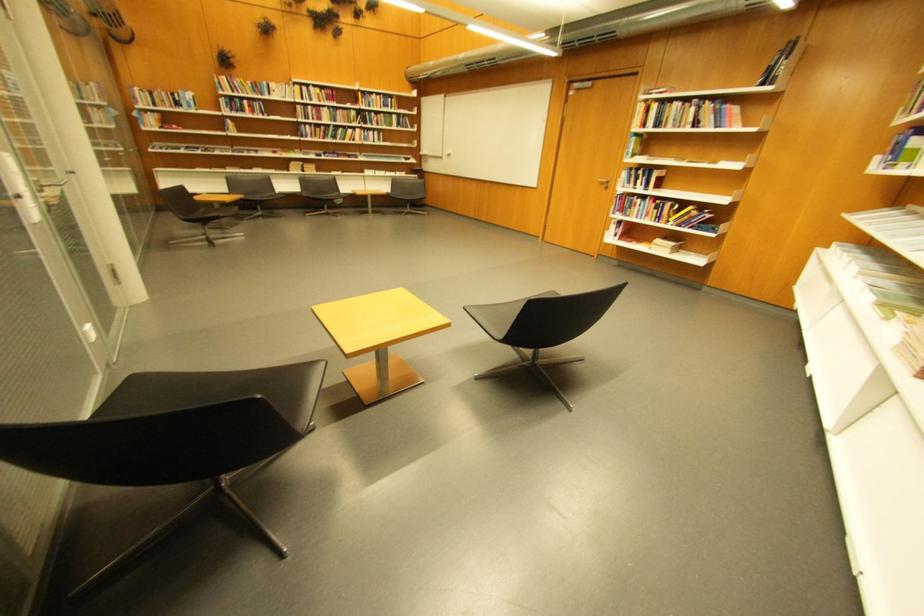
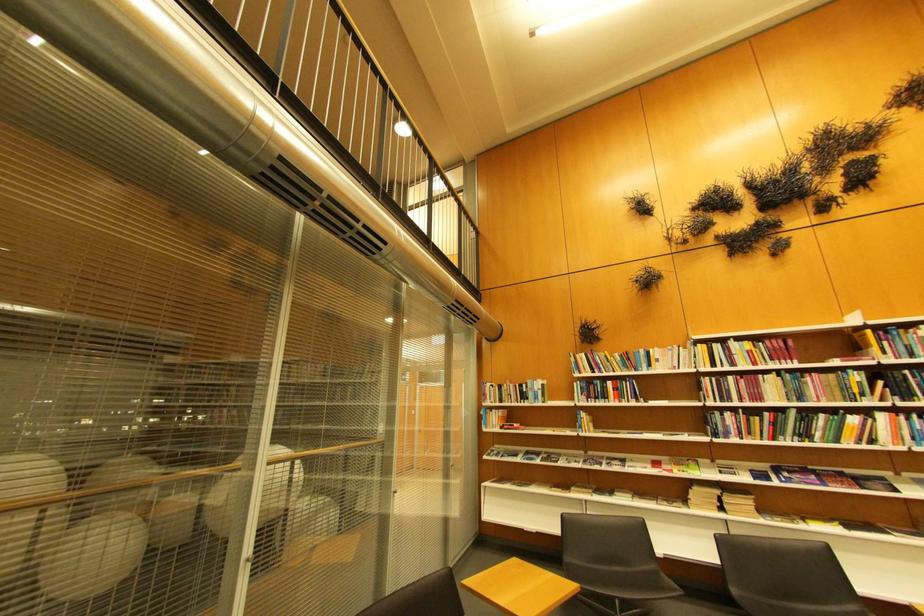
In the second image, find the point that corresponds to point 239,111 in the first image.

(594, 399)